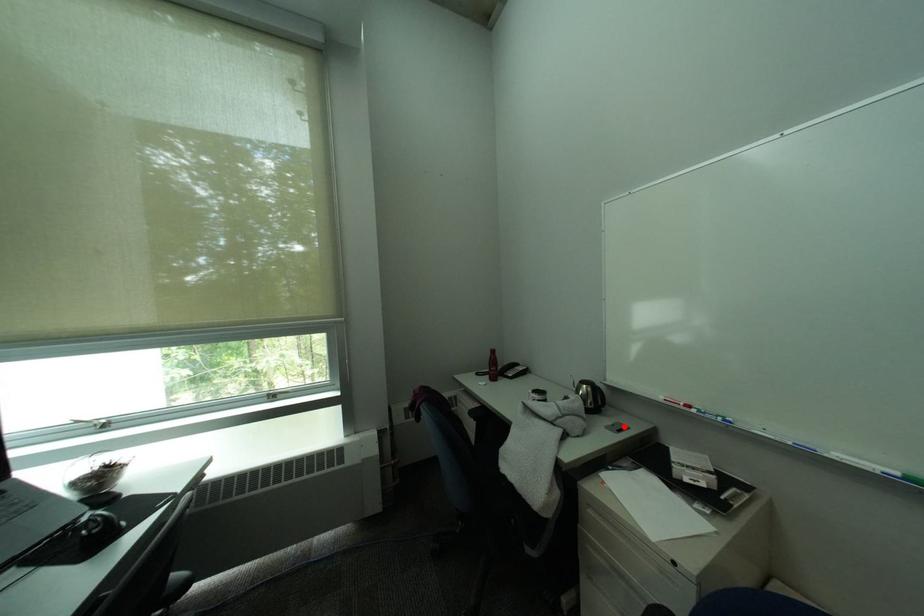
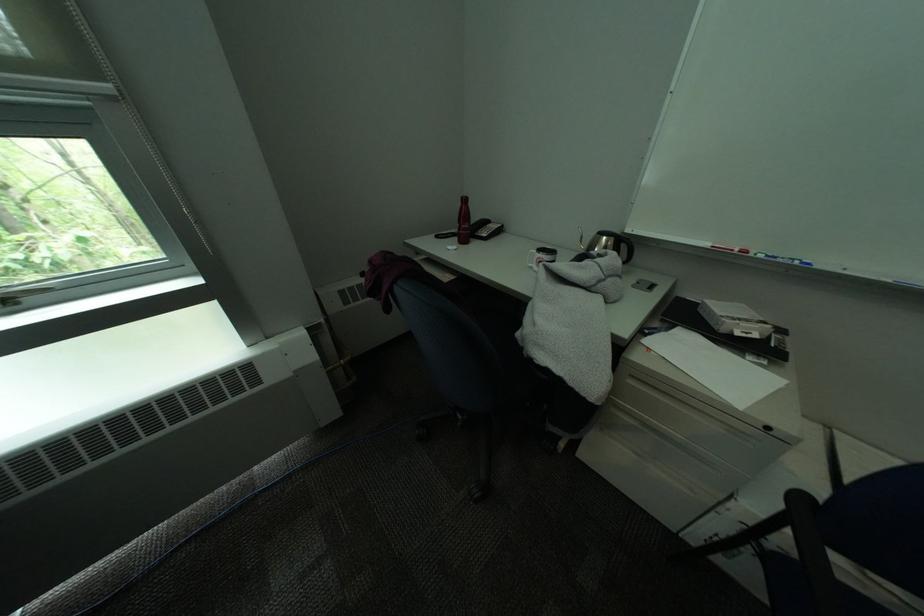
Locate, in the second image, the point that corresponds to the highlighted location in the first image.

(649, 284)